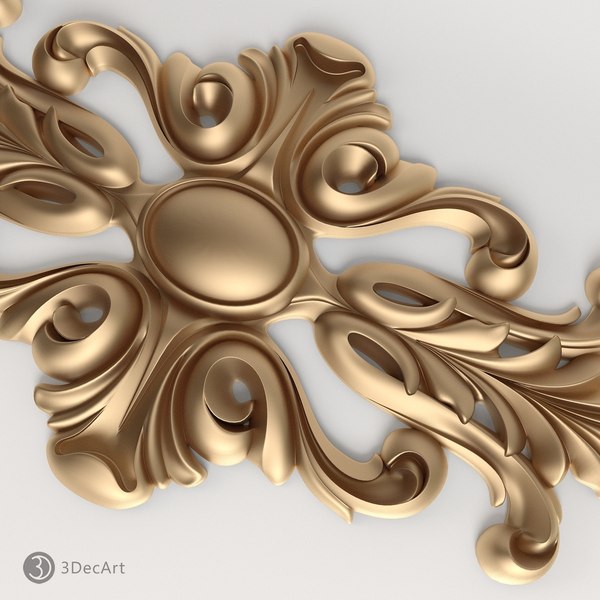
Where is `wall art`? The width and height of the screenshot is (600, 600). wall art is located at coordinates (241, 237).